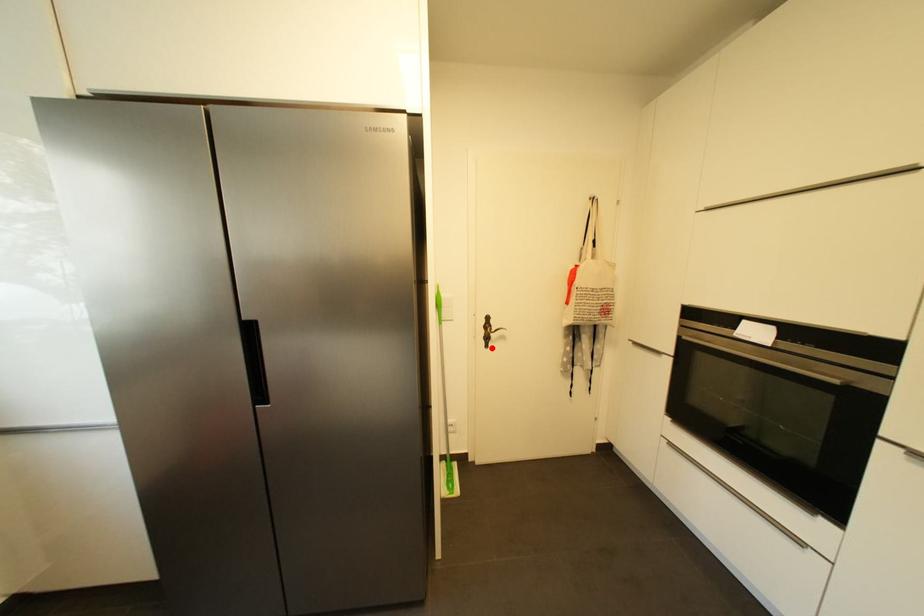
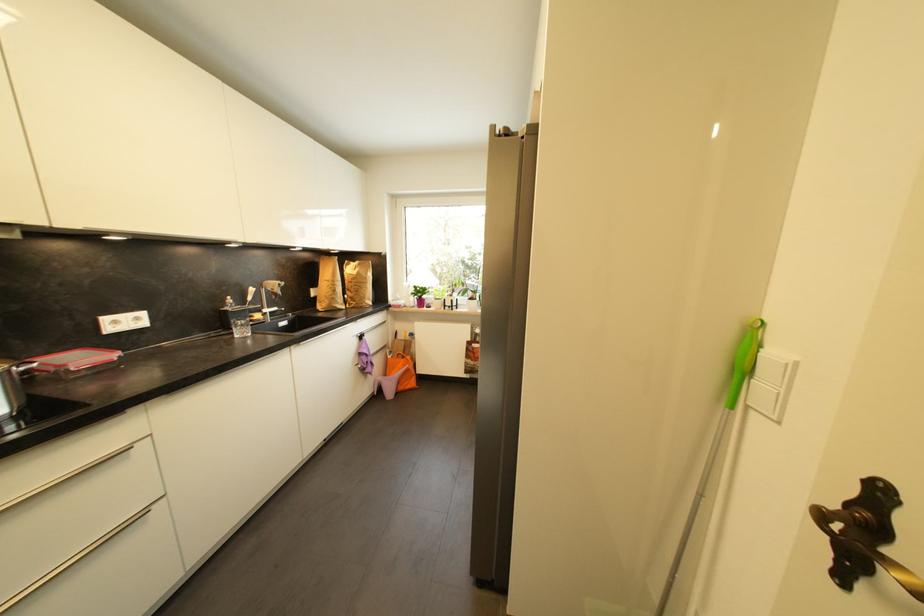
Where in the second image is the point corresponding to the highlighted location from the first image?

(846, 581)